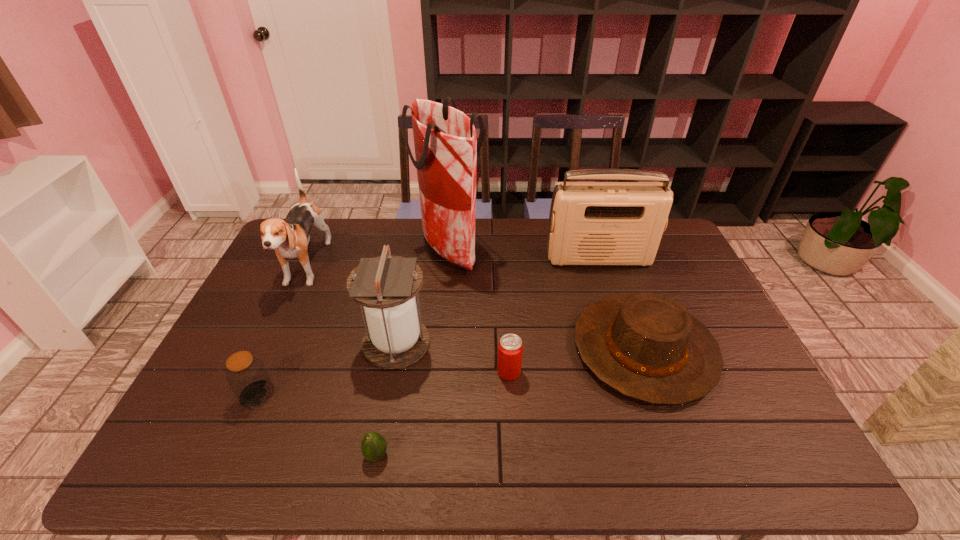
The width and height of the screenshot is (960, 540). What are the coordinates of `free space located 0.300m on the front-facing side of the radio receiver` in the screenshot? It's located at (x=624, y=335).

Find the location of a particular element. The image size is (960, 540). free region located at the face of the puppy is located at coordinates (242, 405).

Where is `vacant space situated 0.330m on the left of the lantern`? The height and width of the screenshot is (540, 960). vacant space situated 0.330m on the left of the lantern is located at coordinates (248, 343).

The height and width of the screenshot is (540, 960). I want to click on vacant space located on the back of the cowboy hat, so click(x=610, y=252).

Identify the location of vacant space positioned 0.090m on the left of the jar. (205, 394).

The height and width of the screenshot is (540, 960). Identify the location of vacant space located on the left of the sixth object from left to right. (468, 372).

Locate an element on the screen. free space located 0.190m on the right of the avocado is located at coordinates (471, 455).

Locate an element on the screen. This screenshot has width=960, height=540. grocery bag situated at the far edge is located at coordinates (446, 145).

This screenshot has height=540, width=960. In order to click on radio receiver at the far edge in this screenshot , I will do `click(591, 223)`.

You are a GUI agent. You are given a task and a screenshot of the screen. Output one action in this format:
    pyautogui.click(x=<x>, y=<y>)
    Task: Click on the puppy at the far edge
    The image size is (960, 540).
    Given the screenshot: What is the action you would take?
    pyautogui.click(x=290, y=238)